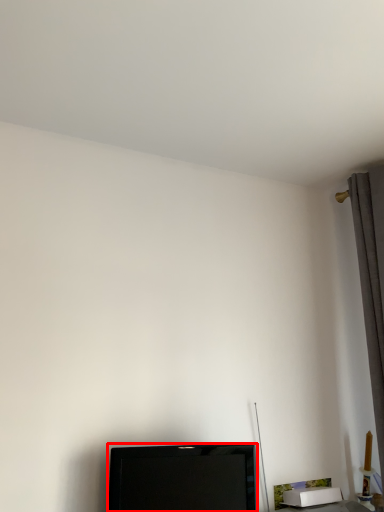
Question: Observing the image, what is the correct spatial positioning of television (annotated by the red box) in reference to curtain?

Choices:
 (A) right
 (B) left

Answer: (B)